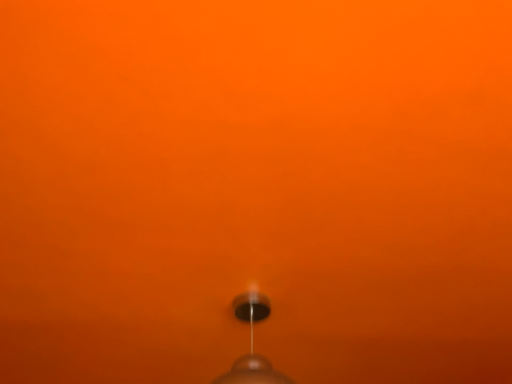
The width and height of the screenshot is (512, 384). What do you see at coordinates (252, 345) in the screenshot? I see `matte black lamp at center` at bounding box center [252, 345].

What is the approximate width of matte black lamp at center?

matte black lamp at center is 12.81 inches in width.

Find the location of a particular element. matte black lamp at center is located at coordinates (252, 345).

Where is `matte black lamp at center`? This screenshot has width=512, height=384. matte black lamp at center is located at coordinates (252, 345).